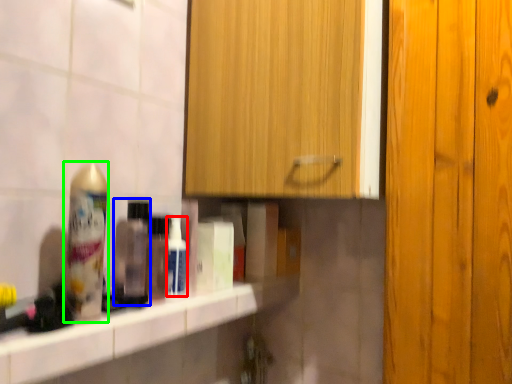
Question: Which object is positioned closest to mouthwash (highlighted by a red box)? Select from mouthwash (highlighted by a blue box) and shaving cream (highlighted by a green box).

Choices:
 (A) mouthwash
 (B) shaving cream

Answer: (A)